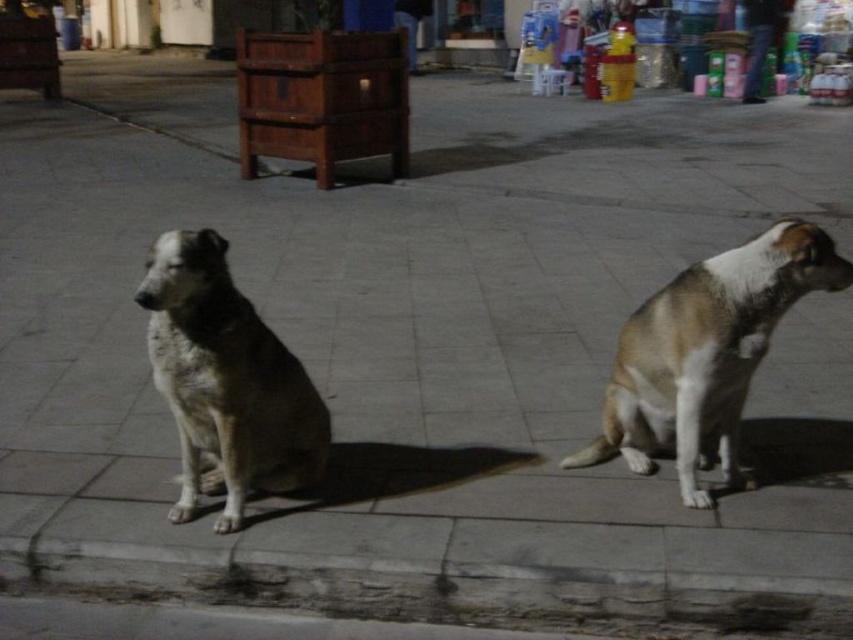
You are a delivery robot navigating a nighttime street. You see a concrete curb at lower center and a fuzzy fur dog at left. Which object is positioned to the right of the other?

The concrete curb at lower center is to the right of the fuzzy fur dog at left.

You are a delivery robot with a width of 1 meter. You need to move through the space between the brown fur dog at right and the fuzzy fur dog at left. Can you fit through the space between them?

The distance between the brown fur dog at right and the fuzzy fur dog at left is 1.28 meters, which is wider than the robot width of 1 meter. Therefore, the robot can fit through the space between them.